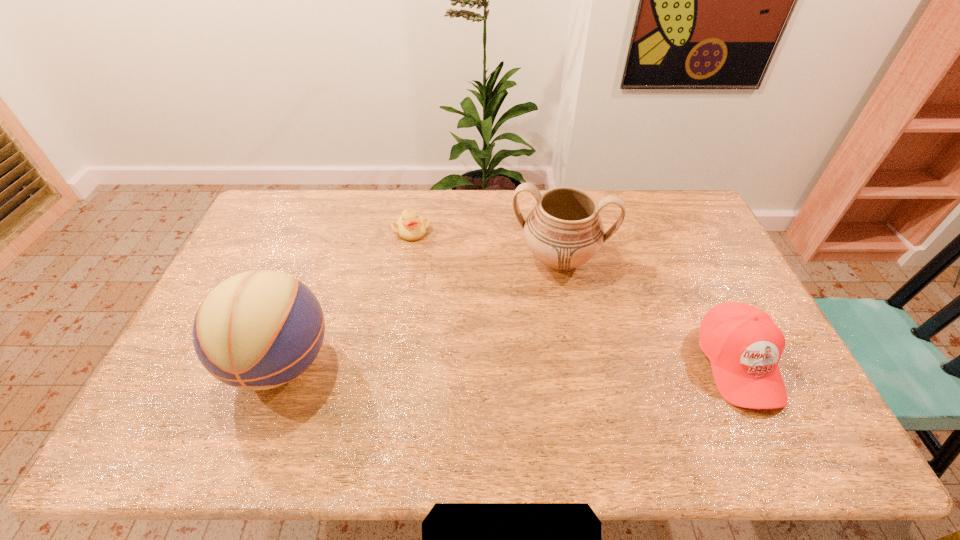
At what (x,y) coordinates should I click in order to perform the action: click on vacant space on the desktop that is between the basketball and the third tallest object and is positioned on the front-facing side of the urn. Please return your answer as a coordinate pair (x, y). The image size is (960, 540). Looking at the image, I should click on (540, 363).

Where is `free space on the desktop that is between the leftmost object and the rightmost object and is positioned at the face of the duckling`? The height and width of the screenshot is (540, 960). free space on the desktop that is between the leftmost object and the rightmost object and is positioned at the face of the duckling is located at coordinates (526, 363).